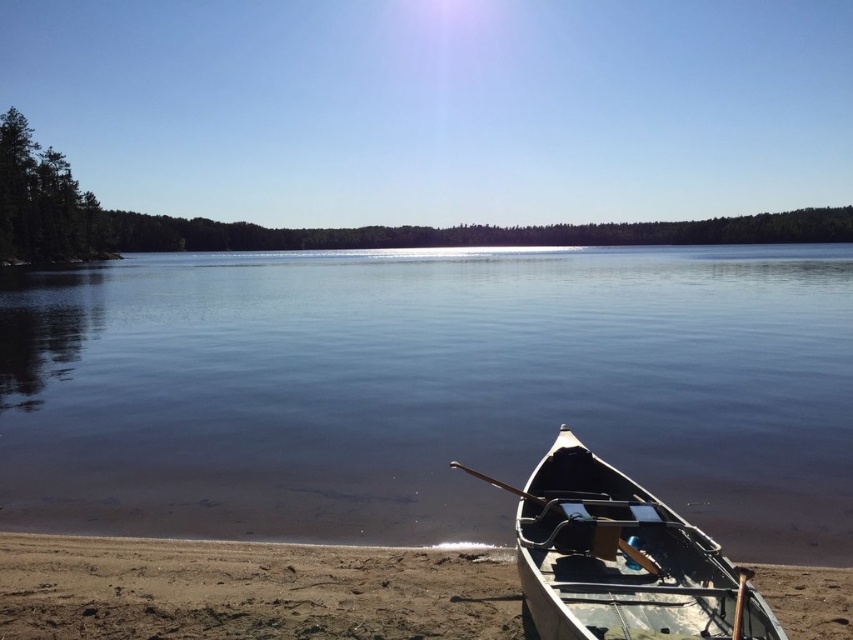
Question: Which object is positioned farthest from the clear water at center?

Choices:
 (A) light gray wooden canoe at lower right
 (B) brown sandy beach at lower right

Answer: (B)

Question: Does brown sandy beach at lower right appear on the left side of light gray wooden canoe at lower right?

Choices:
 (A) yes
 (B) no

Answer: (A)

Question: Considering the real-world distances, which object is closest to the clear water at center?

Choices:
 (A) brown sandy beach at lower right
 (B) light gray wooden canoe at lower right

Answer: (B)

Question: Does clear water at center lie behind light gray wooden canoe at lower right?

Choices:
 (A) no
 (B) yes

Answer: (B)

Question: Does brown sandy beach at lower right have a lesser width compared to light gray wooden canoe at lower right?

Choices:
 (A) yes
 (B) no

Answer: (B)

Question: Among these points, which one is nearest to the camera?

Choices:
 (A) (711, 582)
 (B) (289, 547)

Answer: (A)